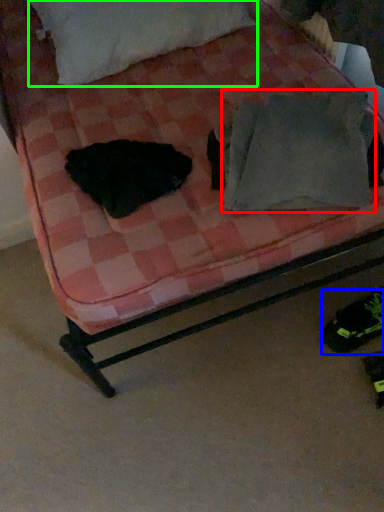
Question: Considering the real-world distances, which object is closest to pillow (highlighted by a red box)? footwear (highlighted by a blue box) or pillow (highlighted by a green box).

Choices:
 (A) footwear
 (B) pillow

Answer: (A)